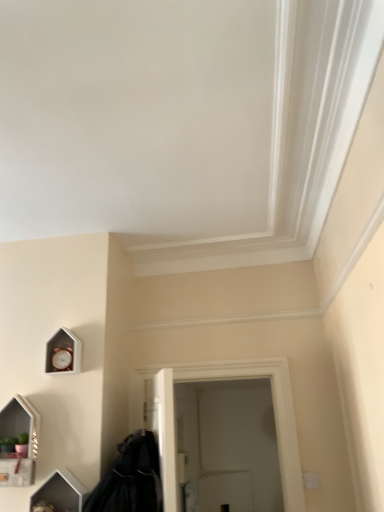
Question: Can white matte door at center be found inside black matte coat at lower left?

Choices:
 (A) no
 (B) yes

Answer: (A)

Question: From the image's perspective, is black matte coat at lower left on white matte door at center?

Choices:
 (A) no
 (B) yes

Answer: (B)

Question: Is black matte coat at lower left positioned beyond the bounds of white matte door at center?

Choices:
 (A) yes
 (B) no

Answer: (A)

Question: Is black matte coat at lower left positioned in front of white matte door at center?

Choices:
 (A) no
 (B) yes

Answer: (B)

Question: Considering the relative sizes of black matte coat at lower left and white matte door at center in the image provided, is black matte coat at lower left taller than white matte door at center?

Choices:
 (A) no
 (B) yes

Answer: (A)

Question: From a real-world perspective, is black matte coat at lower left below white matte door at center?

Choices:
 (A) yes
 (B) no

Answer: (A)

Question: Is matte white medicine cabinet at lower left closer to the viewer compared to wooden clock at lower left?

Choices:
 (A) no
 (B) yes

Answer: (B)

Question: Can you confirm if matte white medicine cabinet at lower left is thinner than wooden clock at lower left?

Choices:
 (A) no
 (B) yes

Answer: (A)

Question: From a real-world perspective, is matte white medicine cabinet at lower left below wooden clock at lower left?

Choices:
 (A) no
 (B) yes

Answer: (B)

Question: Is wooden clock at lower left a part of matte white medicine cabinet at lower left?

Choices:
 (A) no
 (B) yes

Answer: (A)

Question: Does matte white medicine cabinet at lower left have a greater width compared to wooden clock at lower left?

Choices:
 (A) yes
 (B) no

Answer: (A)

Question: Is matte white medicine cabinet at lower left aimed at wooden clock at lower left?

Choices:
 (A) no
 (B) yes

Answer: (A)

Question: From a real-world perspective, is wooden clock at lower left below matte white medicine cabinet at lower left?

Choices:
 (A) no
 (B) yes

Answer: (A)